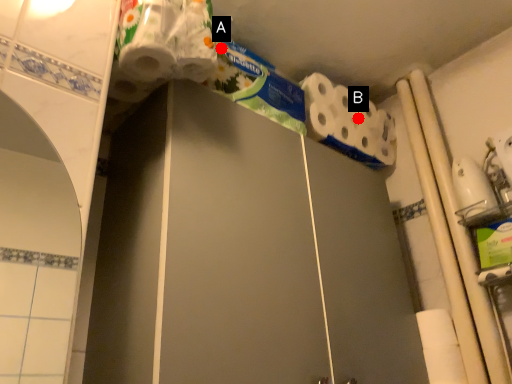
Question: Two points are circled on the image, labeled by A and B beside each circle. Which point is closer to the camera?

Choices:
 (A) A is closer
 (B) B is closer

Answer: (A)